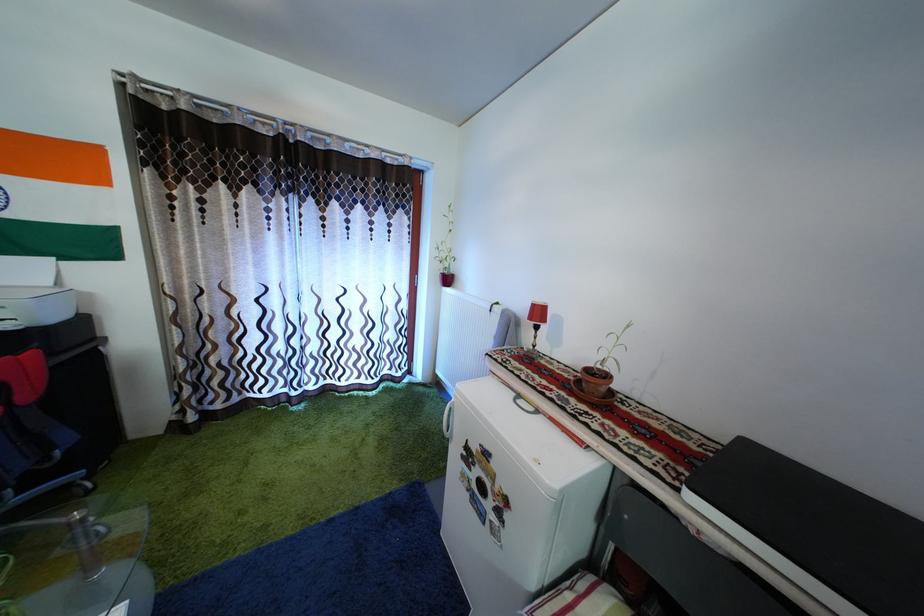
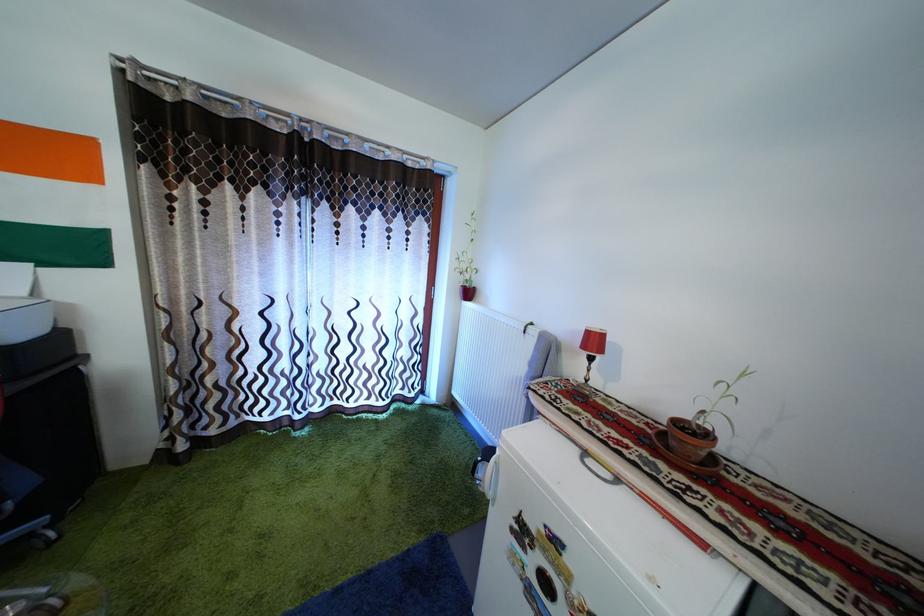
In the second image, find the point that corresponds to (616,384) in the first image.

(715, 442)